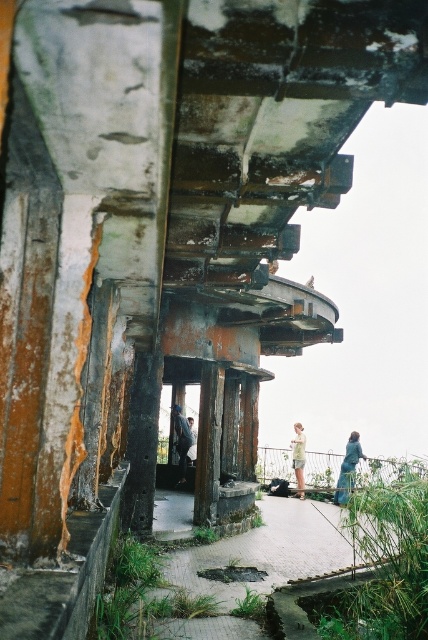
Does paved stone path at center appear over light blue denim jeans at center?

Yes, paved stone path at center is above light blue denim jeans at center.

Can you confirm if paved stone path at center is smaller than light blue denim jeans at center?

Indeed, paved stone path at center has a smaller size compared to light blue denim jeans at center.

Describe the element at coordinates (259, 563) in the screenshot. I see `paved stone path at center` at that location.

The height and width of the screenshot is (640, 428). In order to click on paved stone path at center in this screenshot , I will do `click(259, 563)`.

Is point (347, 464) positioned in front of point (294, 422)?

Yes, point (347, 464) is in front of point (294, 422).

Does blue denim jacket at lower right lie in front of light blue denim jeans at center?

Yes, blue denim jacket at lower right is closer to the viewer.

Find the location of a particular element. The width and height of the screenshot is (428, 640). blue denim jacket at lower right is located at coordinates (347, 468).

Is blue denim jacket at lower right taller than dark gray concrete pillar at center?

Indeed, blue denim jacket at lower right has a greater height compared to dark gray concrete pillar at center.

Which is below, blue denim jacket at lower right or dark gray concrete pillar at center?

blue denim jacket at lower right

Find the location of a particular element. This screenshot has width=428, height=640. blue denim jacket at lower right is located at coordinates (347, 468).